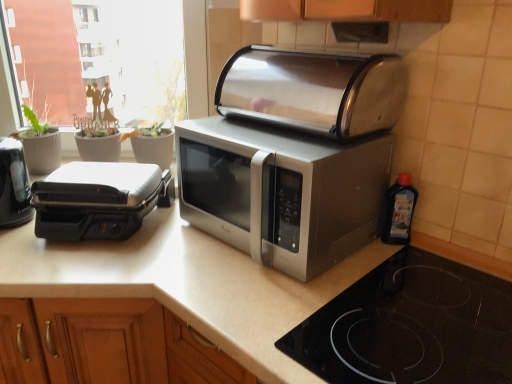
Locate an element on the screen. unoccupied region to the right of transparent plastic bottle at right is located at coordinates (455, 251).